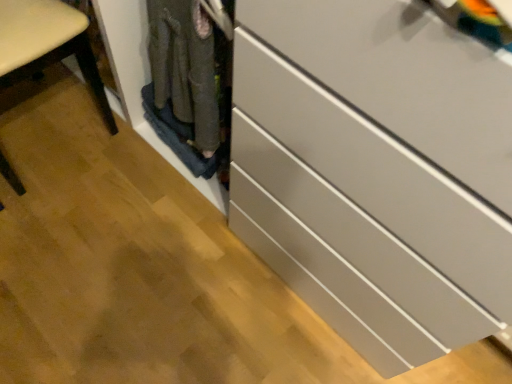
Question: Considering the relative sizes of white glossy chest of drawers at center and matte wood chair at left in the image provided, is white glossy chest of drawers at center bigger than matte wood chair at left?

Choices:
 (A) yes
 (B) no

Answer: (A)

Question: Could you tell me if white glossy chest of drawers at center is facing matte wood chair at left?

Choices:
 (A) no
 (B) yes

Answer: (A)

Question: Is white glossy chest of drawers at center looking in the opposite direction of matte wood chair at left?

Choices:
 (A) no
 (B) yes

Answer: (A)

Question: Is white glossy chest of drawers at center smaller than matte wood chair at left?

Choices:
 (A) no
 (B) yes

Answer: (A)

Question: Does white glossy chest of drawers at center appear on the right side of matte wood chair at left?

Choices:
 (A) yes
 (B) no

Answer: (A)

Question: Is white glossy chest of drawers at center completely or partially outside of matte wood chair at left?

Choices:
 (A) no
 (B) yes

Answer: (B)

Question: Does matte wood chair at left have a greater width compared to white glossy chest of drawers at center?

Choices:
 (A) no
 (B) yes

Answer: (A)

Question: From the image's perspective, is matte wood chair at left located above white glossy chest of drawers at center?

Choices:
 (A) yes
 (B) no

Answer: (A)

Question: Does matte wood chair at left have a smaller size compared to white glossy chest of drawers at center?

Choices:
 (A) yes
 (B) no

Answer: (A)

Question: Is white glossy chest of drawers at center located within matte wood chair at left?

Choices:
 (A) yes
 (B) no

Answer: (B)

Question: Can you confirm if matte wood chair at left is shorter than white glossy chest of drawers at center?

Choices:
 (A) yes
 (B) no

Answer: (B)

Question: From a real-world perspective, is matte wood chair at left over white glossy chest of drawers at center?

Choices:
 (A) no
 (B) yes

Answer: (B)

Question: From the image's perspective, is matte wood chair at left located above or below white glossy chest of drawers at center?

Choices:
 (A) below
 (B) above

Answer: (B)